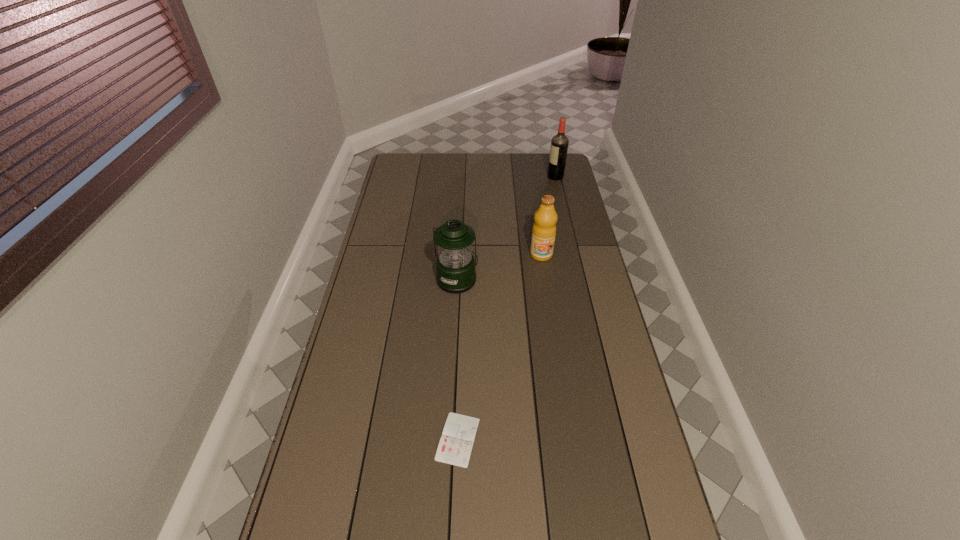
Locate which object ranks second in proximity to the third object from left to right. Please provide its 2D coordinates. Your answer should be formatted as a tuple, i.e. [(x, y)], where the tuple contains the x and y coordinates of a point satisfying the conditions above.

[(559, 144)]

Find the location of a particular element. The height and width of the screenshot is (540, 960). vacant space that satisfies the following two spatial constraints: 1. on the front-facing side of the farthest object; 2. on the front label of the second farthest object is located at coordinates (573, 254).

Image resolution: width=960 pixels, height=540 pixels. In order to click on vacant space that satisfies the following two spatial constraints: 1. on the front-facing side of the rightmost object; 2. on the front label of the fruit juice in this screenshot , I will do `click(573, 254)`.